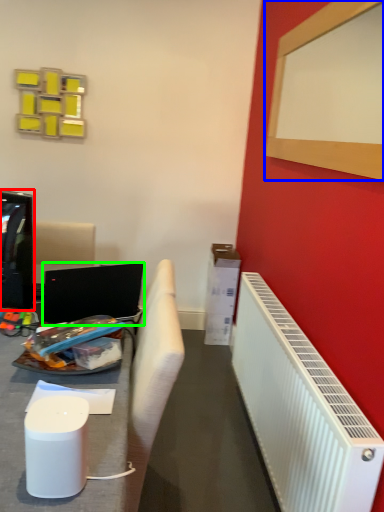
Question: Which is farther away from television (highlighted by a red box)? bulletin board (highlighted by a blue box) or laptop (highlighted by a green box)?

Choices:
 (A) bulletin board
 (B) laptop

Answer: (A)